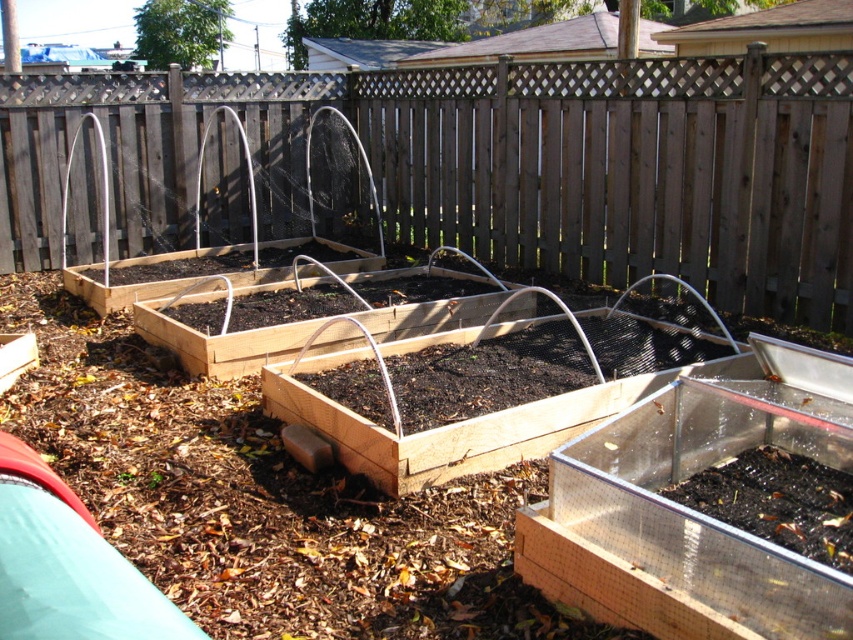
You are standing in the backyard garden and want to locate the brown wooden fence at upper center. According to the coordinates provided, where should you look to find it?

The brown wooden fence at upper center is located at point coordinates of (492, 164).

Looking at this image, you are standing in the backyard garden looking at the raised beds. There is a brown wooden fence somewhere in the scene. Can you tell me where the point at coordinates (492, 164) is located in relation to the brown wooden fence at upper center?

The point at coordinates (492, 164) corresponds exactly to the brown wooden fence at upper center.

You are planning to install a new garden tool rack in your backyard. You want to place it near the brown wooden fence at upper center and the brown wooden raised bed at center. Which object should you place it closer to if you want the rack to be less likely to block the view of the larger structure?

You should place the rack closer to the brown wooden fence at upper center because it is smaller than the brown wooden raised bed at center, so positioning the rack near the smaller object will minimize blocking the view of the larger raised bed.